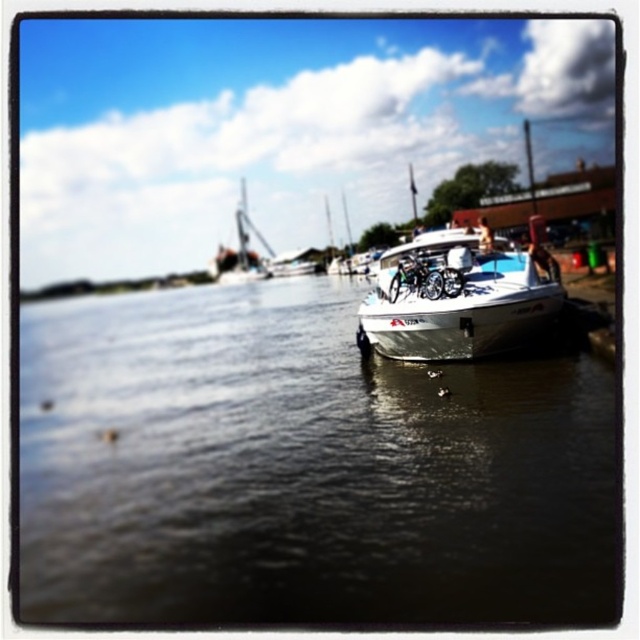
Is white glossy boat at right closer to camera compared to white glossy boat at center?

That is True.

This screenshot has height=640, width=640. What do you see at coordinates (301, 468) in the screenshot?
I see `white glossy boat at right` at bounding box center [301, 468].

Image resolution: width=640 pixels, height=640 pixels. What do you see at coordinates (301, 468) in the screenshot?
I see `white glossy boat at right` at bounding box center [301, 468].

Find the location of a particular element. white glossy boat at right is located at coordinates (301, 468).